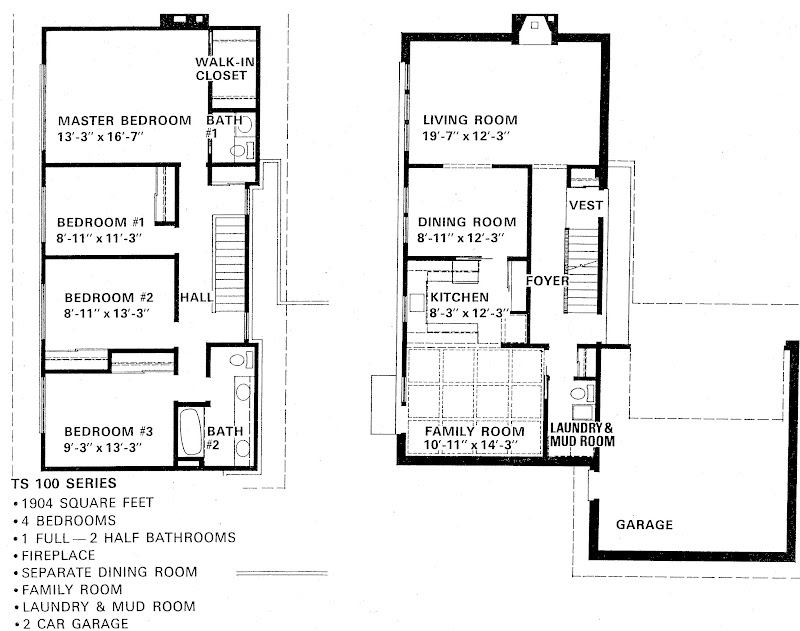
Where is `bathrooms`? This screenshot has width=800, height=631. bathrooms is located at coordinates (222, 397), (222, 143).